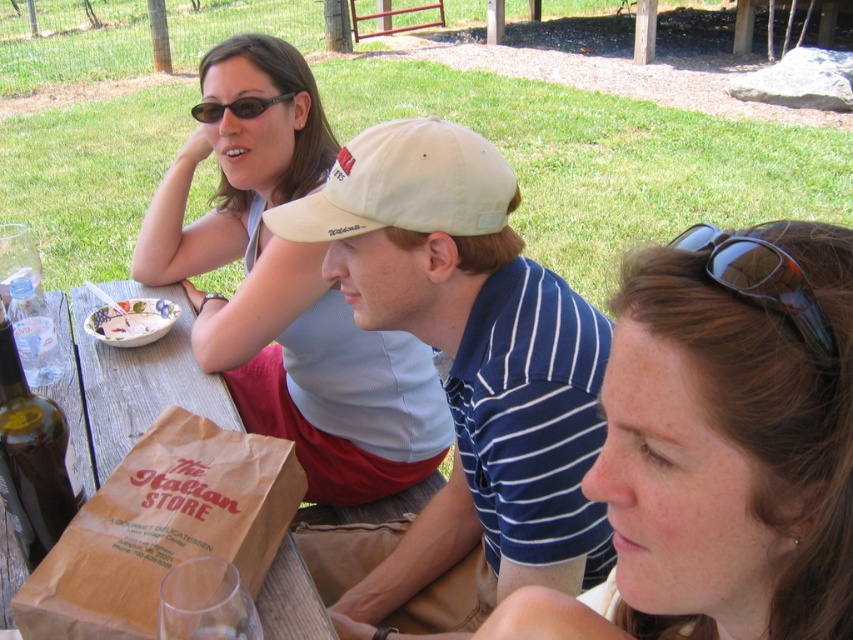
Who is lower down, white cotton cap at center or green glass bottle at lower left?

green glass bottle at lower left is below.

Can you confirm if white cotton cap at center is wider than green glass bottle at lower left?

Yes.

Is point (425, 253) less distant than point (9, 401)?

No, it is not.

Where is `white cotton cap at center`? Image resolution: width=853 pixels, height=640 pixels. white cotton cap at center is located at coordinates (467, 371).

Which is below, white cotton cap at center or white glossy bowl at upper left?

white cotton cap at center is lower down.

Is white cotton cap at center below white glossy bowl at upper left?

Correct, white cotton cap at center is located below white glossy bowl at upper left.

Is point (463, 552) positioned in front of point (112, 328)?

Yes, it is.

Locate an element on the screen. white cotton cap at center is located at coordinates (467, 371).

What do you see at coordinates (721, 445) in the screenshot?
I see `matte brown hair at center` at bounding box center [721, 445].

You are a GUI agent. You are given a task and a screenshot of the screen. Output one action in this format:
    pyautogui.click(x=<x>, y=<y>)
    Task: Click on the matte brown hair at center
    
    Given the screenshot: What is the action you would take?
    [721, 445]

This screenshot has height=640, width=853. I want to click on matte brown hair at center, so click(721, 445).